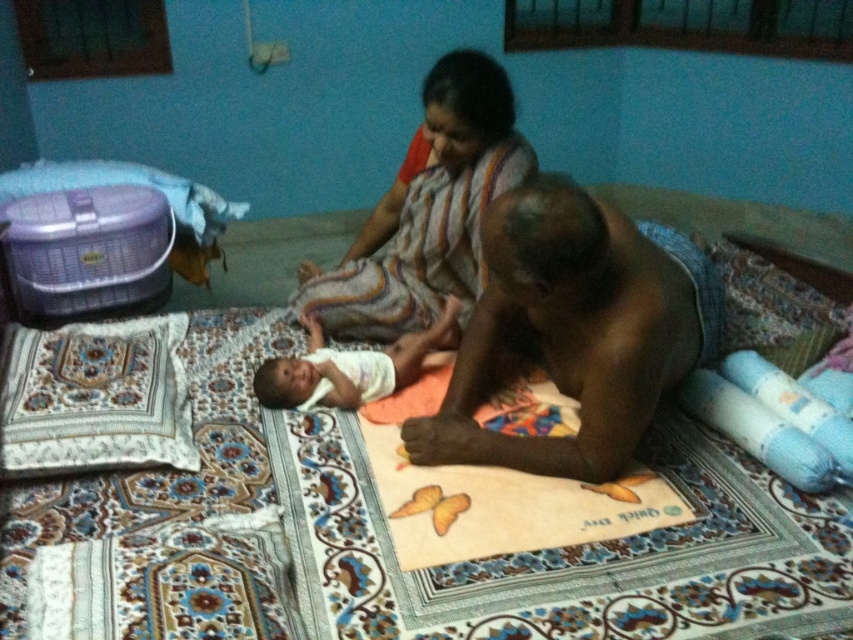
Does point (462, 186) come closer to viewer compared to point (357, 378)?

No, (462, 186) is behind (357, 378).

Where is `striped fabric woman at center`? The height and width of the screenshot is (640, 853). striped fabric woman at center is located at coordinates (427, 209).

Is dark skin man at center further to the viewer compared to white cloth at center?

No, dark skin man at center is closer to the viewer.

Is point (699, 339) positioned after point (267, 396)?

No, (699, 339) is closer to viewer.

Which is in front, point (636, 328) or point (252, 385)?

Point (636, 328) is more forward.

Find the location of a particular element. The image size is (853, 640). dark skin man at center is located at coordinates (573, 330).

Between point (634, 388) and point (451, 189), which one is positioned in front?

Point (634, 388) is in front.

Who is positioned more to the right, dark skin man at center or striped fabric woman at center?

Positioned to the right is dark skin man at center.

Where is `dark skin man at center`? The width and height of the screenshot is (853, 640). dark skin man at center is located at coordinates (573, 330).

The image size is (853, 640). In order to click on dark skin man at center in this screenshot , I will do `click(573, 330)`.